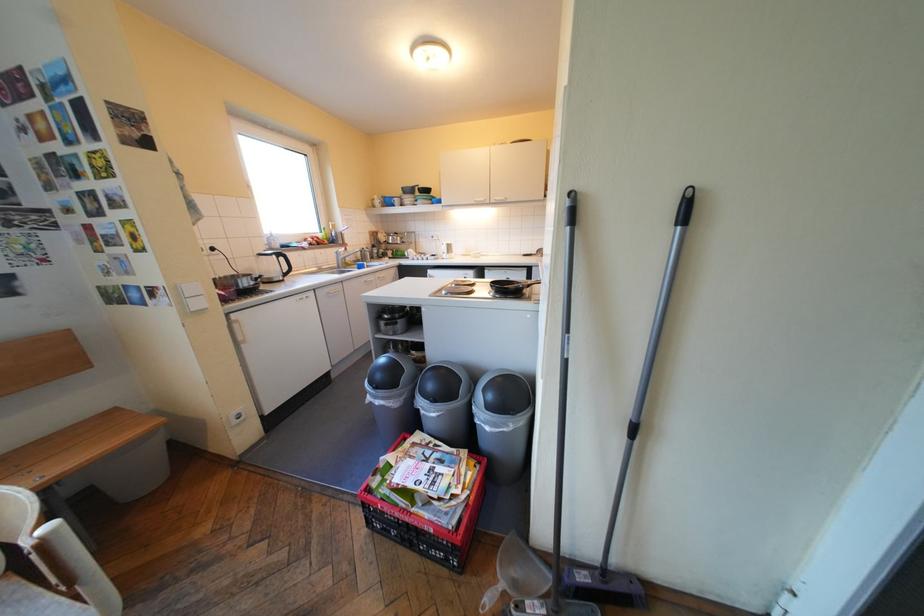
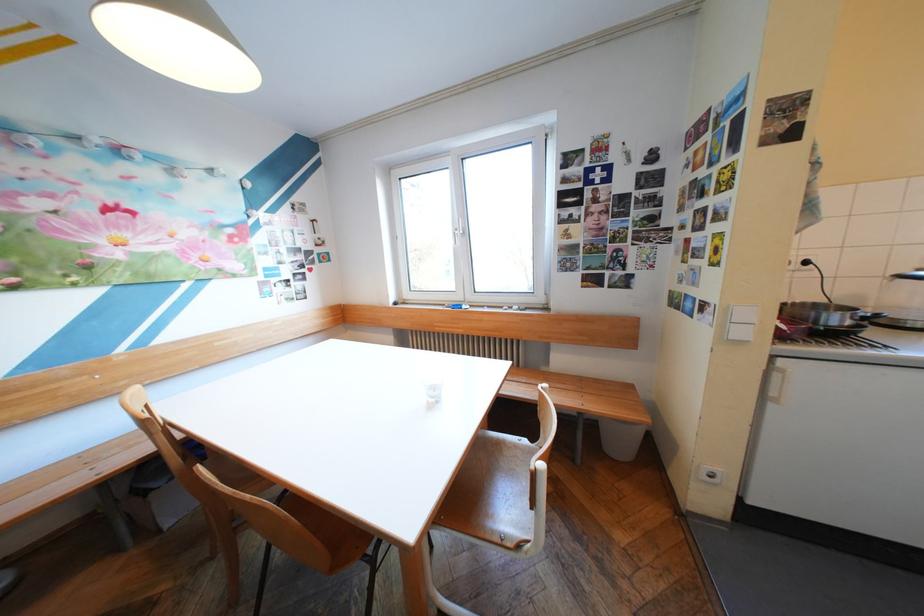
Locate, in the second image, the point that corresponds to point 250,342 in the first image.

(776, 397)